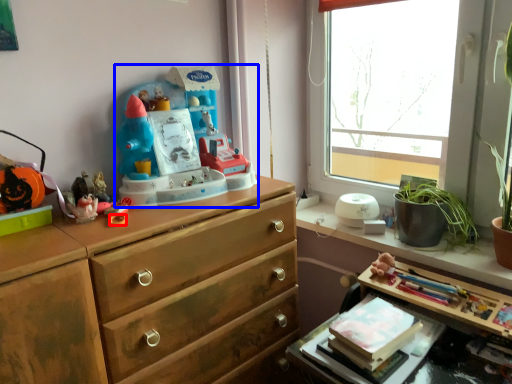
Question: Among these objects, which one is farthest to the camera, knob (highlighted by a red box) or toy (highlighted by a blue box)?

Choices:
 (A) knob
 (B) toy

Answer: (A)